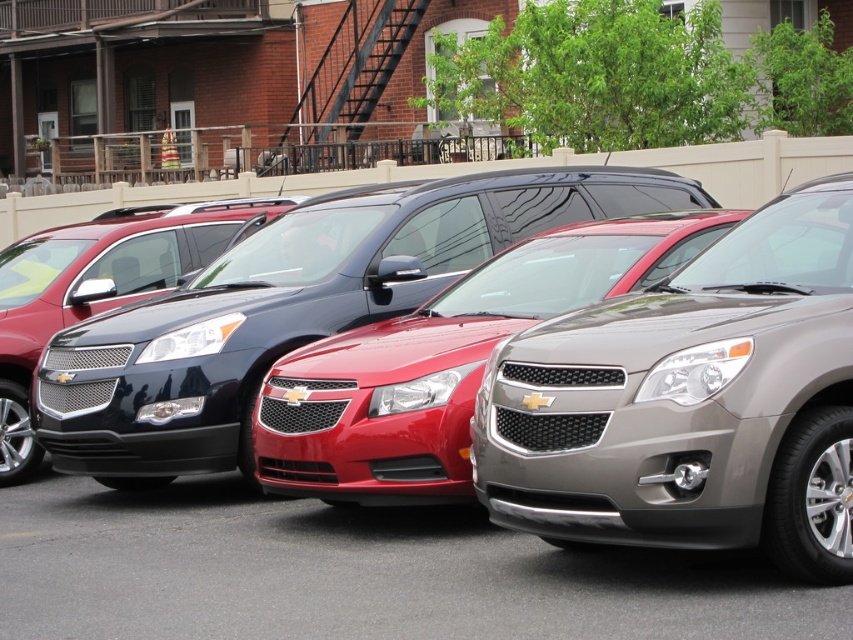
Question: Estimate the real-world distances between objects in this image. Which object is farther from the satin black suv at center?

Choices:
 (A) satin silver suv at center
 (B) metallic red car at center

Answer: (A)

Question: Can you confirm if satin silver suv at center is positioned to the left of metallic red car at center?

Choices:
 (A) yes
 (B) no

Answer: (B)

Question: Which of the following is the closest to the observer?

Choices:
 (A) (676, 200)
 (B) (170, 266)
 (C) (236, 582)
 (D) (521, 388)

Answer: (D)

Question: Does satin silver suv at center appear on the right side of metallic red car at center?

Choices:
 (A) no
 (B) yes

Answer: (B)

Question: Which of these objects is positioned closest to the glossy black minivan at center?

Choices:
 (A) metallic red car at center
 (B) satin silver suv at center
 (C) satin black suv at center

Answer: (C)

Question: Does glossy black minivan at center have a larger size compared to satin black suv at center?

Choices:
 (A) yes
 (B) no

Answer: (A)